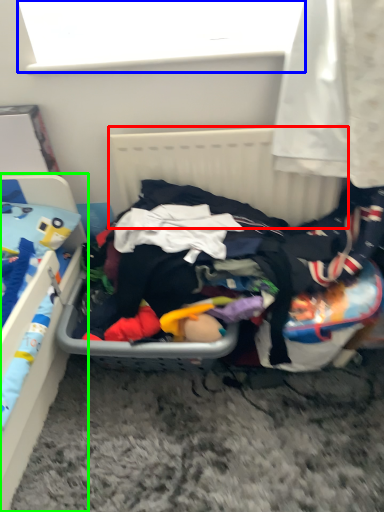
Question: Estimate the real-world distances between objects in this image. Which object is closer to radiator (highlighted by a red box), window screen (highlighted by a blue box) or furniture (highlighted by a green box)?

Choices:
 (A) window screen
 (B) furniture

Answer: (A)